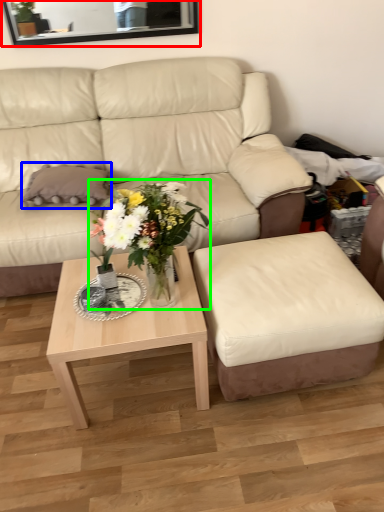
Question: Which is nearer to the mirror (highlighted by a red box)? pillow (highlighted by a blue box) or houseplant (highlighted by a green box).

Choices:
 (A) pillow
 (B) houseplant

Answer: (A)